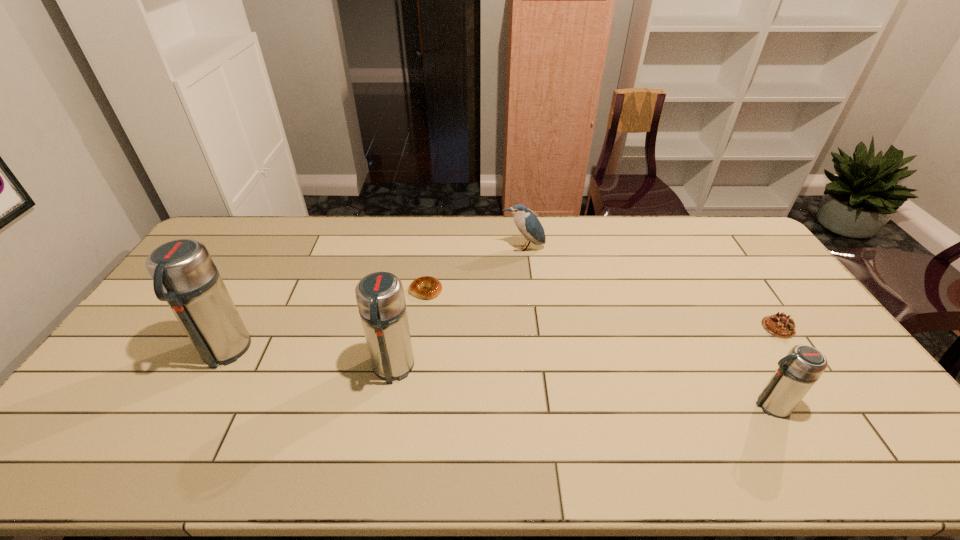
You are a GUI agent. You are given a task and a screenshot of the screen. Output one action in this format:
    pyautogui.click(x=<x>, y=<y>)
    Task: Click on the chocolate cake
    
    Given the screenshot: What is the action you would take?
    pyautogui.click(x=779, y=325)

Where is `blank space located 0.050m with a handle on the side of the leftmost object`? The width and height of the screenshot is (960, 540). blank space located 0.050m with a handle on the side of the leftmost object is located at coordinates (202, 392).

I want to click on free location located with a handle on the side of the nearest object, so click(x=708, y=405).

Where is `vacant area situated 0.210m with a handle on the side of the nearest object`? vacant area situated 0.210m with a handle on the side of the nearest object is located at coordinates (669, 405).

This screenshot has width=960, height=540. I want to click on vacant space located with a handle on the side of the nearest object, so [x=728, y=405].

Locate an element on the screen. The width and height of the screenshot is (960, 540). free space located at the tip of the farthest object's beak is located at coordinates (527, 285).

Image resolution: width=960 pixels, height=540 pixels. Find the location of `vacant area located on the front of the shortest object`. vacant area located on the front of the shortest object is located at coordinates (416, 361).

Locate an element on the screen. The image size is (960, 540). blank space located on the back of the rightmost object is located at coordinates (749, 284).

Where is `object that is at the far edge`? object that is at the far edge is located at coordinates (527, 223).

Find the location of a particular element. The width and height of the screenshot is (960, 540). object situated at the near edge is located at coordinates (798, 371).